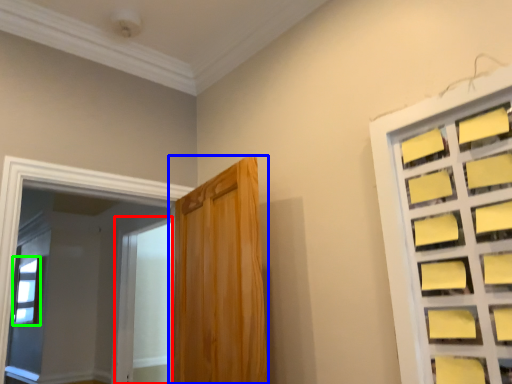
Question: Estimate the real-world distances between objects in this image. Which object is closer to screen door (highlighted by a red box), door (highlighted by a blue box) or window (highlighted by a green box)?

Choices:
 (A) door
 (B) window

Answer: (B)